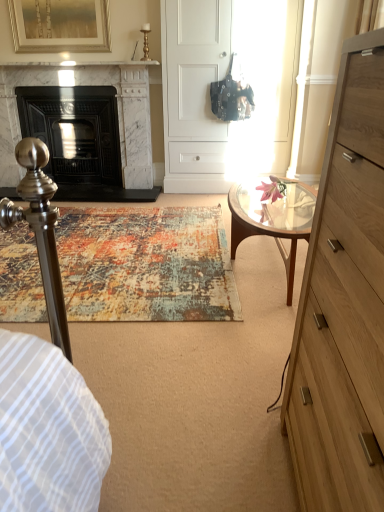
Question: Is clear glass coffee table at center closer to camera compared to gold-framed artwork at upper left?

Choices:
 (A) yes
 (B) no

Answer: (A)

Question: Is clear glass coffee table at center at the right side of gold-framed artwork at upper left?

Choices:
 (A) no
 (B) yes

Answer: (B)

Question: Is clear glass coffee table at center facing away from gold-framed artwork at upper left?

Choices:
 (A) yes
 (B) no

Answer: (B)

Question: Is gold-framed artwork at upper left completely or partially inside clear glass coffee table at center?

Choices:
 (A) no
 (B) yes

Answer: (A)

Question: Can we say clear glass coffee table at center lies outside gold-framed artwork at upper left?

Choices:
 (A) no
 (B) yes

Answer: (B)

Question: Is clear glass coffee table at center smaller than gold-framed artwork at upper left?

Choices:
 (A) no
 (B) yes

Answer: (A)

Question: Is gold-framed artwork at upper left located outside white marble fireplace at left, which is counted as the first fireplace, starting from the right?

Choices:
 (A) yes
 (B) no

Answer: (A)

Question: Would you say white marble fireplace at left, which is the 2th fireplace from left to right, is part of gold-framed artwork at upper left's contents?

Choices:
 (A) no
 (B) yes

Answer: (A)

Question: Can you confirm if gold-framed artwork at upper left is thinner than white marble fireplace at left, which is counted as the first fireplace, starting from the right?

Choices:
 (A) yes
 (B) no

Answer: (A)

Question: Is gold-framed artwork at upper left with white marble fireplace at left, which is the 2th fireplace from left to right?

Choices:
 (A) no
 (B) yes

Answer: (A)

Question: Does gold-framed artwork at upper left turn towards white marble fireplace at left, which is counted as the first fireplace, starting from the right?

Choices:
 (A) yes
 (B) no

Answer: (B)

Question: Can you confirm if gold-framed artwork at upper left is shorter than white marble fireplace at left, which is counted as the first fireplace, starting from the right?

Choices:
 (A) no
 (B) yes

Answer: (B)

Question: From the image's perspective, would you say matte black fireplace at left, which is the second fireplace from right to left, is positioned over light brown wood chest of drawers at right?

Choices:
 (A) no
 (B) yes

Answer: (B)